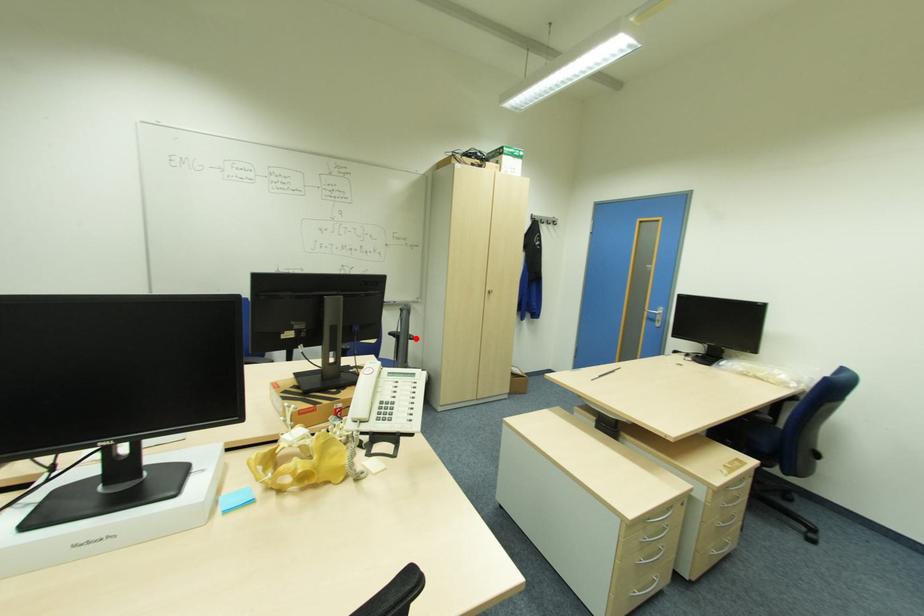
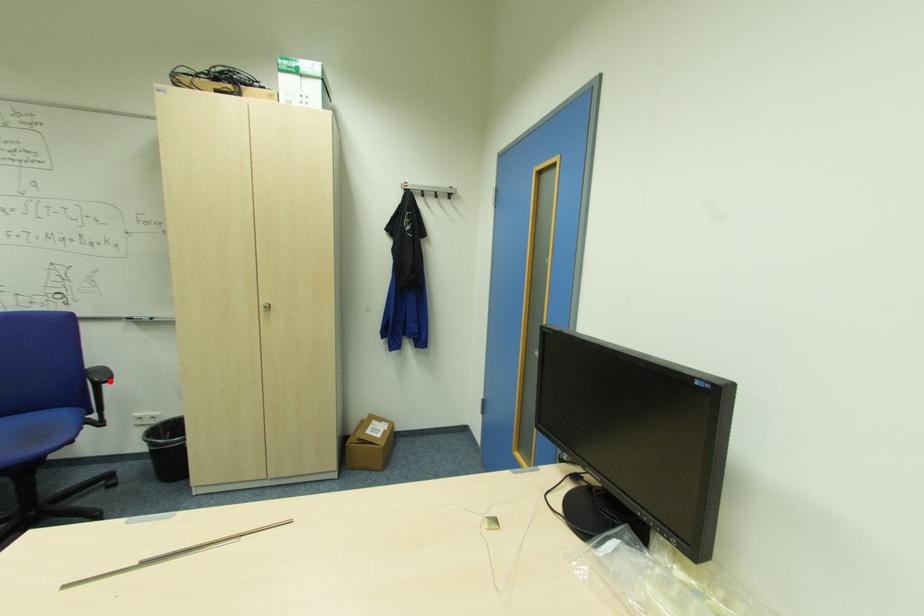
I am providing you with two images of the same scene from different viewpoints. A red point is marked on the first image and another point is marked on the second image. Is the marked point in image1 the same physical position as the marked point in image2?

Yes